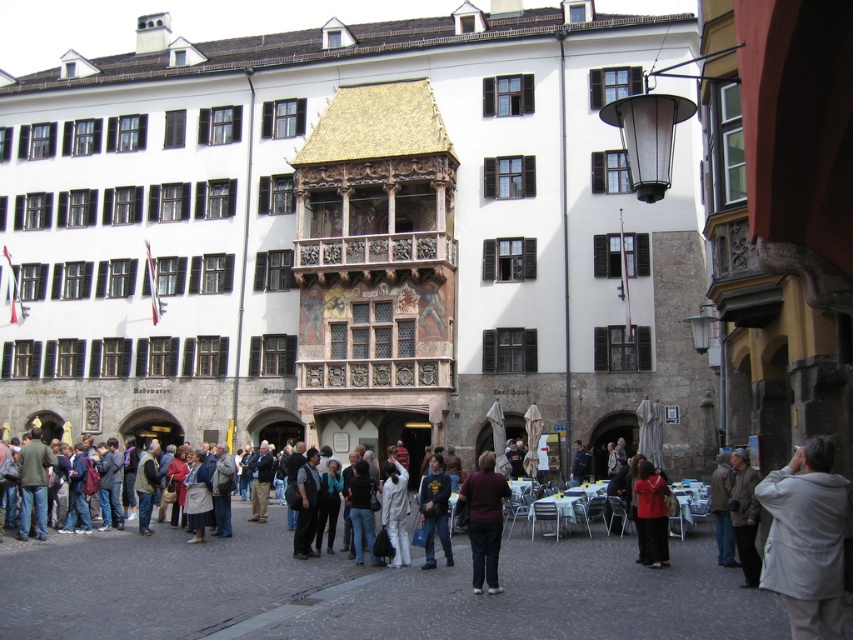
You are a photographer standing in the square and want to capture both the light gray fabric jacket at lower right and the dark blue cotton shirt at center in a single photo. Which clothing item will appear bigger in the photo?

The light gray fabric jacket at lower right will appear bigger in the photo because it has a larger size compared to the dark blue cotton shirt at center.

You are a photographer trying to capture a candid shot of two people in the center of the square. The subjects are wearing dark brown fabric pants at center and white matte jacket at center. Based on their clothing dimensions, which clothing item is wider?

The dark brown fabric pants at center are wider than the white matte jacket at center, as the pants have a greater width according to the description.